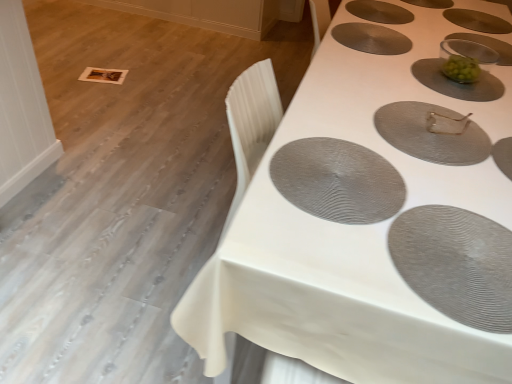
At what (x,y) coordinates should I click in order to perform the action: click on empty space that is ontop of gray textured placemat at lower right, arranged as the seventh oval when viewed from the back (from a real-world perspective). Please return your answer as a coordinate pair (x, y). Looking at the image, I should click on (457, 250).